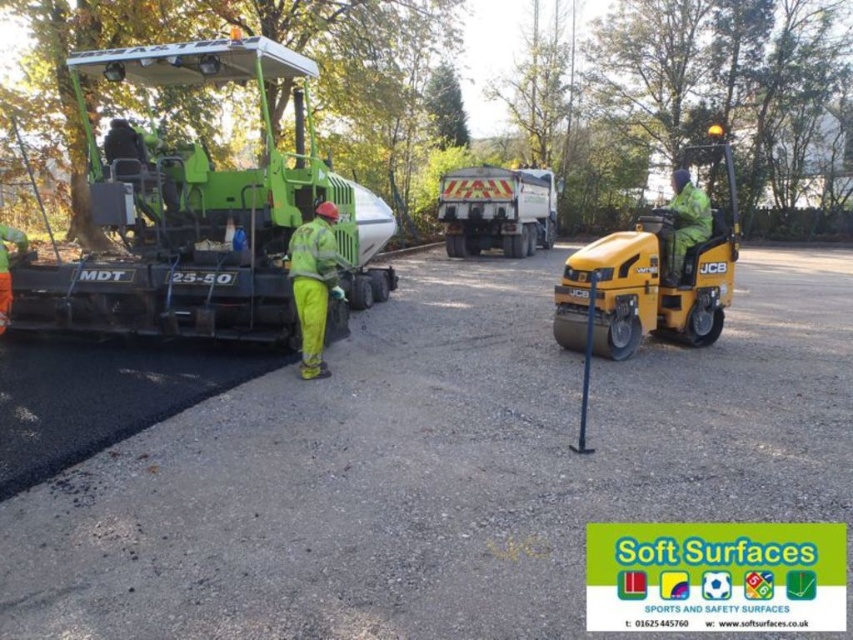
Based on the scene description, where is the green rubberized asphalt paver at left located in the image?

The green rubberized asphalt paver at left is located at point (206, 216) in the image.

You are standing at the point labeled point (73, 268) and want to take a photo of the construction site. The camera you are using has a focal length of 50mm and a sensor size of 24mm x 36mm. What is the minimum distance you need to move towards the camera to ensure the entire construction site fits within the frame?

The point labeled point (73, 268) is 7.55 meters away from the camera. To ensure the entire construction site fits within the frame, you need to move closer to the camera until the distance between you and the camera is less than or equal to 7.55 meters.

You are a safety inspector on the construction site. You need to check the distance between the yellow rubber jcb at right and the yellow reflective plastic truck at center. Which one is nearer to you?

The yellow rubber jcb at right is closer to the viewer than the yellow reflective plastic truck at center, so the yellow rubber jcb at right is nearer to you.